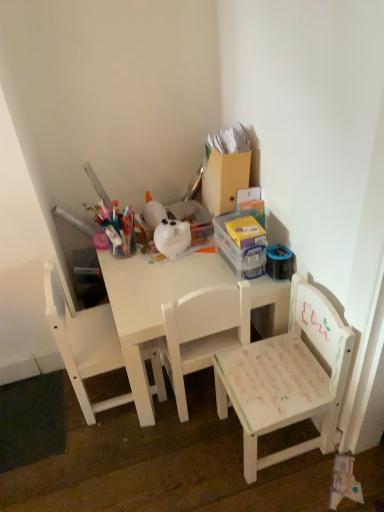
This screenshot has height=512, width=384. What do you see at coordinates (83, 343) in the screenshot?
I see `white matte chair at center, the first chair from the left` at bounding box center [83, 343].

This screenshot has width=384, height=512. Describe the element at coordinates (202, 332) in the screenshot. I see `white painted wood chair at center, placed as the second chair when sorted from left to right` at that location.

Measure the distance between white matte table at center and camera.

white matte table at center and camera are 1.20 meters apart from each other.

The image size is (384, 512). I want to click on white matte chair at center, which ranks as the third chair in right-to-left order, so click(83, 343).

From the image's perspective, does white painted wood chair at lower right, the first chair from the right, appear lower than white painted wood chair at center, marked as the 2th chair in a right-to-left arrangement?

Correct, white painted wood chair at lower right, the first chair from the right, appears lower than white painted wood chair at center, marked as the 2th chair in a right-to-left arrangement, in the image.

Is the surface of white painted wood chair at lower right, the first chair from the right, in direct contact with white painted wood chair at center, placed as the second chair when sorted from left to right?

No.

Is white painted wood chair at center, placed as the second chair when sorted from left to right, located within white painted wood chair at lower right, which appears as the 3th chair when viewed from the left?

Definitely not — white painted wood chair at center, placed as the second chair when sorted from left to right, is not inside white painted wood chair at lower right, which appears as the 3th chair when viewed from the left.

Considering the relative positions of white matte table at center and white painted wood chair at lower right, which appears as the 3th chair when viewed from the left, in the image provided, is white matte table at center to the left or to the right of white painted wood chair at lower right, which appears as the 3th chair when viewed from the left,?

In the image, white matte table at center appears on the left side of white painted wood chair at lower right, which appears as the 3th chair when viewed from the left.

Considering the relative sizes of white matte table at center and white painted wood chair at lower right, which appears as the 3th chair when viewed from the left, in the image provided, is white matte table at center wider than white painted wood chair at lower right, which appears as the 3th chair when viewed from the left,?

Correct, the width of white matte table at center exceeds that of white painted wood chair at lower right, which appears as the 3th chair when viewed from the left.

Which point is more distant from viewer, (119, 297) or (278, 372)?

The point (119, 297) is behind.

Where is `table that is under the white painted wood chair at lower right, which appears as the 3th chair when viewed from the left (from a real-world perspective)`? The width and height of the screenshot is (384, 512). table that is under the white painted wood chair at lower right, which appears as the 3th chair when viewed from the left (from a real-world perspective) is located at coordinates (153, 304).

Is white painted wood chair at lower right, the first chair from the right, positioned with its back to white matte chair at center, which ranks as the third chair in right-to-left order?

No.

Starting from the white painted wood chair at lower right, which appears as the 3th chair when viewed from the left, which chair is the 2nd one behind? Please provide its 2D coordinates.

[(83, 343)]

Between white painted wood chair at lower right, the first chair from the right, and white matte chair at center, the first chair from the left, which one has smaller size?

white matte chair at center, the first chair from the left, is smaller.

Considering the sizes of white painted wood chair at lower right, which appears as the 3th chair when viewed from the left, and white matte chair at center, which ranks as the third chair in right-to-left order, in the image, is white painted wood chair at lower right, which appears as the 3th chair when viewed from the left, wider or thinner than white matte chair at center, which ranks as the third chair in right-to-left order,?

In the image, white painted wood chair at lower right, which appears as the 3th chair when viewed from the left, appears to be wider than white matte chair at center, which ranks as the third chair in right-to-left order.

The image size is (384, 512). In order to click on table that appears above the white matte chair at center, which ranks as the third chair in right-to-left order (from the image's perspective) in this screenshot , I will do `click(153, 304)`.

Considering the sizes of white matte table at center and white matte chair at center, which ranks as the third chair in right-to-left order, in the image, is white matte table at center taller or shorter than white matte chair at center, which ranks as the third chair in right-to-left order,?

In the image, white matte table at center appears to be shorter than white matte chair at center, which ranks as the third chair in right-to-left order.

Is point (152, 273) closer to viewer compared to point (95, 413)?

Yes.

Which object is wider, white matte table at center or white matte chair at center, the first chair from the left?

white matte table at center.

Measure the distance between white matte chair at center, the first chair from the left, and white painted wood chair at lower right, the first chair from the right.

white matte chair at center, the first chair from the left, is 17.07 inches from white painted wood chair at lower right, the first chair from the right.

In the image, is white matte chair at center, the first chair from the left, on the left side or the right side of white painted wood chair at lower right, the first chair from the right?

Based on their positions, white matte chair at center, the first chair from the left, is located to the left of white painted wood chair at lower right, the first chair from the right.

Choose the correct answer: Is white matte chair at center, which ranks as the third chair in right-to-left order, inside white painted wood chair at lower right, the first chair from the right, or outside it?

white matte chair at center, which ranks as the third chair in right-to-left order, exists outside the volume of white painted wood chair at lower right, the first chair from the right.

From the image's perspective, count 1st chairs upward from the white painted wood chair at lower right, the first chair from the right, and point to it. Please provide its 2D coordinates.

[(83, 343)]

Is point (170, 315) closer to viewer compared to point (102, 347)?

Yes, it is in front of point (102, 347).

From a real-world perspective, is white painted wood chair at center, marked as the 2th chair in a right-to-left arrangement, positioned above or below white matte chair at center, the first chair from the left?

Clearly, from a real-world perspective, white painted wood chair at center, marked as the 2th chair in a right-to-left arrangement, is below white matte chair at center, the first chair from the left.

Who is bigger, white painted wood chair at center, marked as the 2th chair in a right-to-left arrangement, or white matte chair at center, the first chair from the left?

white matte chair at center, the first chair from the left, is bigger.

Is white painted wood chair at center, marked as the 2th chair in a right-to-left arrangement, taller than white matte chair at center, the first chair from the left?

Yes, white painted wood chair at center, marked as the 2th chair in a right-to-left arrangement, is taller than white matte chair at center, the first chair from the left.

From a real-world perspective, which chair is the 2nd one above the white matte table at center? Please provide its 2D coordinates.

[(202, 332)]

Based on their positions, is white matte table at center located to the left or right of white painted wood chair at center, marked as the 2th chair in a right-to-left arrangement?

white matte table at center is positioned on white painted wood chair at center, marked as the 2th chair in a right-to-left arrangement,'s left side.

Does white matte table at center have a lesser height compared to white painted wood chair at center, marked as the 2th chair in a right-to-left arrangement?

Correct, white matte table at center is not as tall as white painted wood chair at center, marked as the 2th chair in a right-to-left arrangement.

Is white painted wood chair at center, placed as the second chair when sorted from left to right, completely or partially inside white matte table at center?

Yes, white painted wood chair at center, placed as the second chair when sorted from left to right, can be found within white matte table at center.

The height and width of the screenshot is (512, 384). What are the coordinates of `chair below the white painted wood chair at center, marked as the 2th chair in a right-to-left arrangement (from a real-world perspective)` in the screenshot? It's located at (287, 378).

In the image, there is a white painted wood chair at lower right, the first chair from the right. Where is `table above it (from the image's perspective)`? table above it (from the image's perspective) is located at coordinates (153, 304).

Which object lies nearer to the anchor point white painted wood chair at center, marked as the 2th chair in a right-to-left arrangement, white painted wood chair at lower right, which appears as the 3th chair when viewed from the left, or white matte chair at center, the first chair from the left?

white painted wood chair at lower right, which appears as the 3th chair when viewed from the left, is positioned closer to the anchor white painted wood chair at center, marked as the 2th chair in a right-to-left arrangement.

From the image, which object appears to be farther from white painted wood chair at center, marked as the 2th chair in a right-to-left arrangement, white painted wood chair at lower right, which appears as the 3th chair when viewed from the left, or white matte table at center?

Based on the image, white painted wood chair at lower right, which appears as the 3th chair when viewed from the left, appears to be further to white painted wood chair at center, marked as the 2th chair in a right-to-left arrangement.

Based on their spatial positions, is white painted wood chair at center, placed as the second chair when sorted from left to right, or white matte table at center further from white matte chair at center, the first chair from the left?

white painted wood chair at center, placed as the second chair when sorted from left to right, is positioned further to the anchor white matte chair at center, the first chair from the left.

From the image, which object appears to be farther from white painted wood chair at lower right, which appears as the 3th chair when viewed from the left, white painted wood chair at center, marked as the 2th chair in a right-to-left arrangement, or white matte chair at center, the first chair from the left?

Based on the image, white matte chair at center, the first chair from the left, appears to be further to white painted wood chair at lower right, which appears as the 3th chair when viewed from the left.

From the image, which object appears to be nearer to white matte chair at center, which ranks as the third chair in right-to-left order, white painted wood chair at lower right, the first chair from the right, or white matte table at center?

white matte table at center.

Considering their positions, is white matte table at center positioned further to white matte chair at center, the first chair from the left, than white painted wood chair at center, marked as the 2th chair in a right-to-left arrangement?

white painted wood chair at center, marked as the 2th chair in a right-to-left arrangement, is positioned further to the anchor white matte chair at center, the first chair from the left.

Based on their spatial positions, is white painted wood chair at center, marked as the 2th chair in a right-to-left arrangement, or white matte table at center further from white painted wood chair at lower right, which appears as the 3th chair when viewed from the left?

white matte table at center is positioned further to the anchor white painted wood chair at lower right, which appears as the 3th chair when viewed from the left.

Which object lies nearer to the anchor point white painted wood chair at center, marked as the 2th chair in a right-to-left arrangement, white matte chair at center, the first chair from the left, or white matte table at center?

white matte table at center is positioned closer to the anchor white painted wood chair at center, marked as the 2th chair in a right-to-left arrangement.

Where is `chair between white matte table at center and white painted wood chair at lower right, which appears as the 3th chair when viewed from the left`? Image resolution: width=384 pixels, height=512 pixels. chair between white matte table at center and white painted wood chair at lower right, which appears as the 3th chair when viewed from the left is located at coordinates (202, 332).

Where is `table between white matte chair at center, which ranks as the third chair in right-to-left order, and white painted wood chair at center, placed as the second chair when sorted from left to right`? This screenshot has width=384, height=512. table between white matte chair at center, which ranks as the third chair in right-to-left order, and white painted wood chair at center, placed as the second chair when sorted from left to right is located at coordinates (153, 304).

You are a GUI agent. You are given a task and a screenshot of the screen. Output one action in this format:
    pyautogui.click(x=<x>, y=<y>)
    Task: Click on the chair between white matte chair at center, which ranks as the third chair in right-to-left order, and white painted wood chair at lower right, the first chair from the right, in the horizontal direction
    This screenshot has height=512, width=384.
    Given the screenshot: What is the action you would take?
    pyautogui.click(x=202, y=332)

Where is `table located between white matte chair at center, which ranks as the third chair in right-to-left order, and white painted wood chair at lower right, the first chair from the right, in the left-right direction`? This screenshot has height=512, width=384. table located between white matte chair at center, which ranks as the third chair in right-to-left order, and white painted wood chair at lower right, the first chair from the right, in the left-right direction is located at coordinates (153, 304).